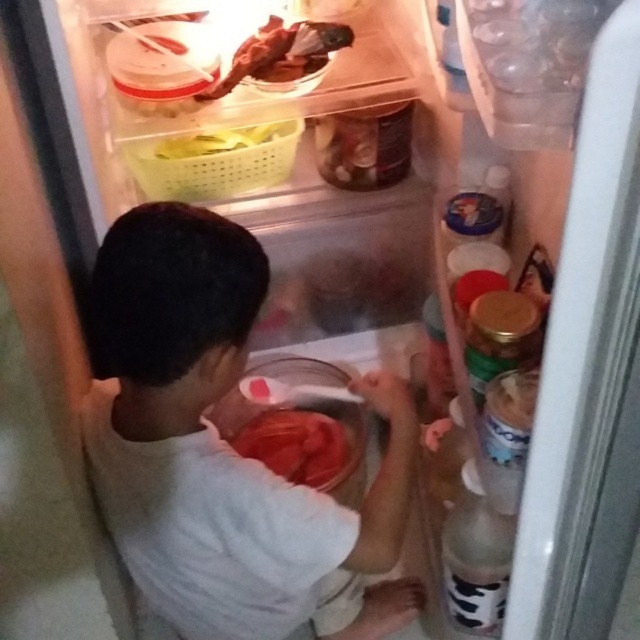
You are organizing the contents of the refrigerator and need to place a new jar of pickles. The jar has a diameter of 10 cm. The space where you want to place it is between the shiny red meat at center and the green plastic basket. Can you fit the jar there?

The position of shiny red meat at center is at point (296, 445). Since the exact distance between the shiny red meat at center and the green plastic basket isn t provided, it s impossible to determine if the jar will fit. Please check the available space.

You are standing in front of a person wearing a white cotton shirt at center. There is a point marked at coordinate (x=225, y=449). Where is this point located on the person?

The point at coordinate (x=225, y=449) is located on the white cotton shirt at center.